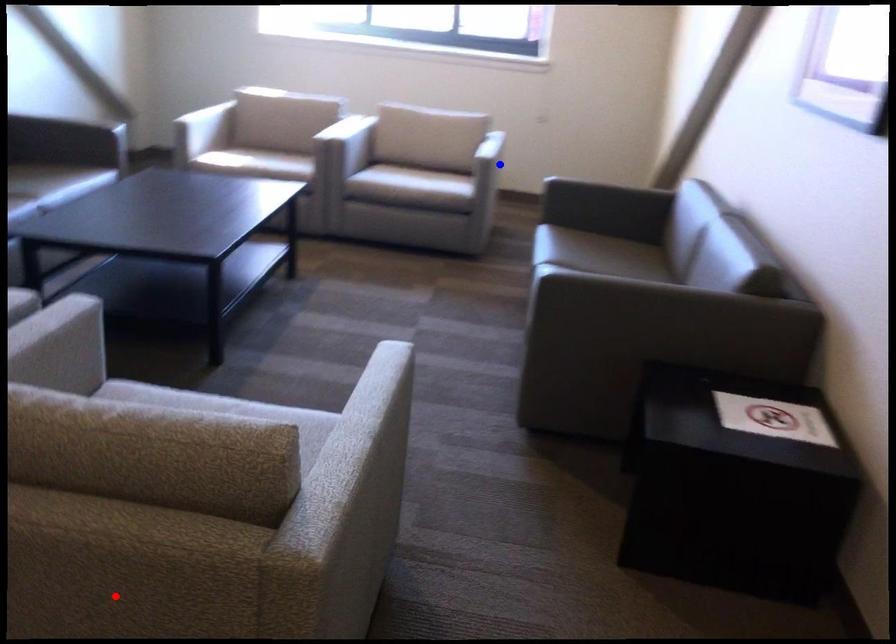
Question: Which of the two points in the image is closer to the camera?

Choices:
 (A) Blue point is closer.
 (B) Red point is closer.

Answer: (B)